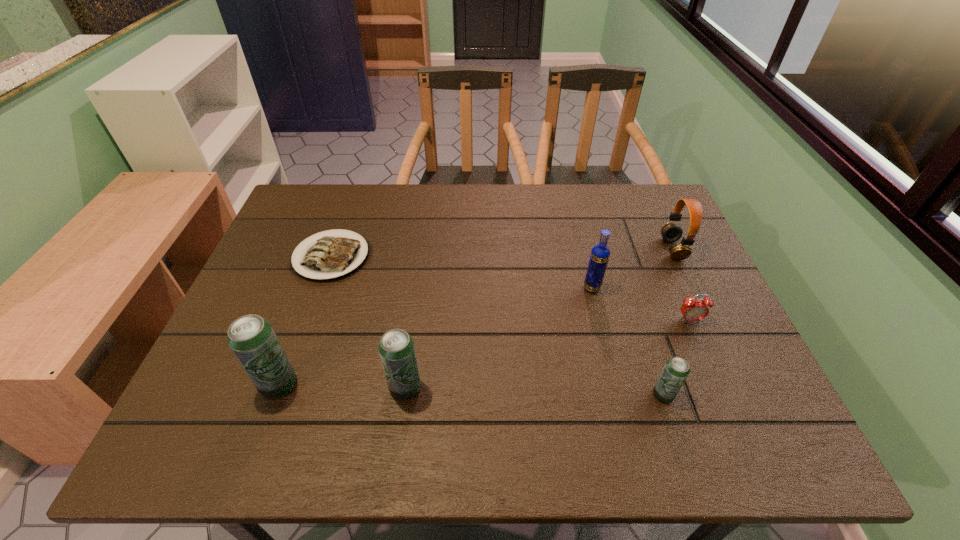
I want to click on beer can situated at the left edge, so click(251, 338).

Identify the location of plate at the left edge. The width and height of the screenshot is (960, 540). (332, 256).

Identify the location of headset that is at the right edge. (671, 232).

Find the location of a particular element. This screenshot has width=960, height=540. alarm clock located at the right edge is located at coordinates (692, 310).

You are a GUI agent. You are given a task and a screenshot of the screen. Output one action in this format:
    pyautogui.click(x=<x>, y=<y>)
    Task: Click on the object at the far left corner
    Image resolution: width=960 pixels, height=540 pixels.
    Given the screenshot: What is the action you would take?
    pyautogui.click(x=332, y=256)

You are a GUI agent. You are given a task and a screenshot of the screen. Output one action in this format:
    pyautogui.click(x=<x>, y=<y>)
    Task: Click on the object at the near left corner
    
    Given the screenshot: What is the action you would take?
    pyautogui.click(x=251, y=338)

Find the location of a particular element. The width and height of the screenshot is (960, 540). vacant space at the far edge of the desktop is located at coordinates (579, 224).

In the image, there is a desktop. Identify the location of vacant space at the near edge. pos(401,407).

In the image, there is a desktop. Find the location of `vacant space at the left edge`. vacant space at the left edge is located at coordinates (278, 271).

In the image, there is a desktop. Identify the location of vacant space at the right edge. (650, 237).